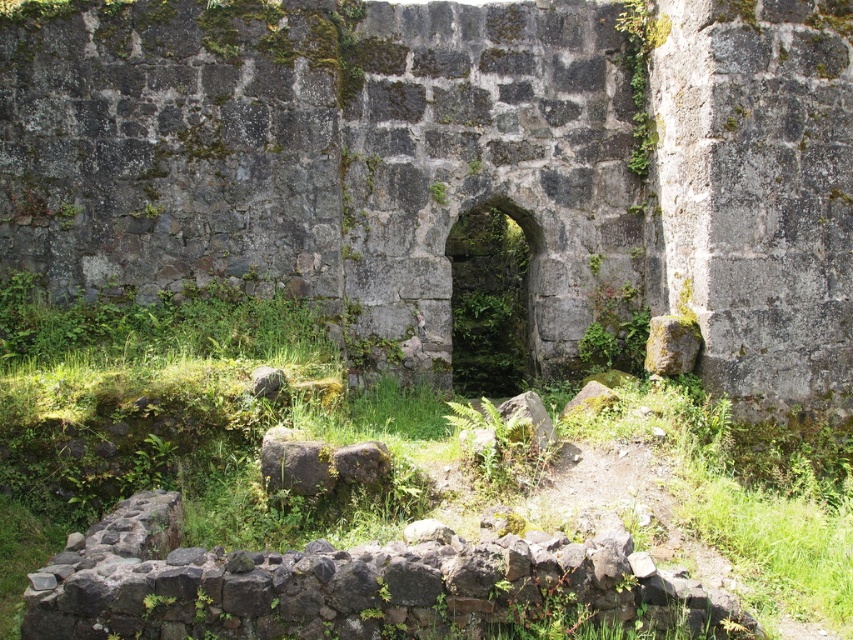
Looking at this image, does gray stone arch at center appear on the left side of green mossy stone archway at center?

No, gray stone arch at center is not to the left of green mossy stone archway at center.

Which is behind, point (229, 179) or point (476, 221)?

Point (476, 221)

Where is `gray stone arch at center`? The width and height of the screenshot is (853, 640). gray stone arch at center is located at coordinates (451, 168).

Is green grass at center to the right of gray rough stone at center from the viewer's perspective?

Yes, green grass at center is to the right of gray rough stone at center.

Is green grass at center closer to the viewer compared to gray rough stone at center?

Yes, it is in front of gray rough stone at center.

Between point (242, 348) and point (254, 371), which one is positioned in front?

Point (254, 371)

You are a GUI agent. You are given a task and a screenshot of the screen. Output one action in this format:
    pyautogui.click(x=<x>, y=<y>)
    Task: Click on the green grass at center
    
    Given the screenshot: What is the action you would take?
    pyautogui.click(x=347, y=442)

Does green grass at center have a lesser height compared to green mossy stone archway at center?

Yes, green grass at center is shorter than green mossy stone archway at center.

Consider the image. Is green grass at center above green mossy stone archway at center?

Incorrect, green grass at center is not positioned above green mossy stone archway at center.

This screenshot has height=640, width=853. What do you see at coordinates (347, 442) in the screenshot?
I see `green grass at center` at bounding box center [347, 442].

At what (x,y) coordinates should I click in order to perform the action: click on green grass at center. Please return your answer as a coordinate pair (x, y). Looking at the image, I should click on 347,442.